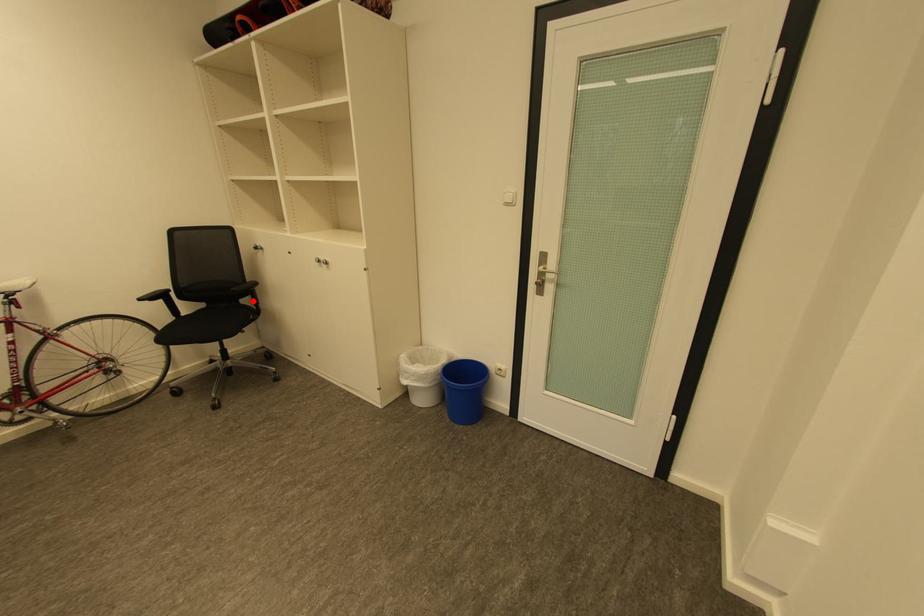
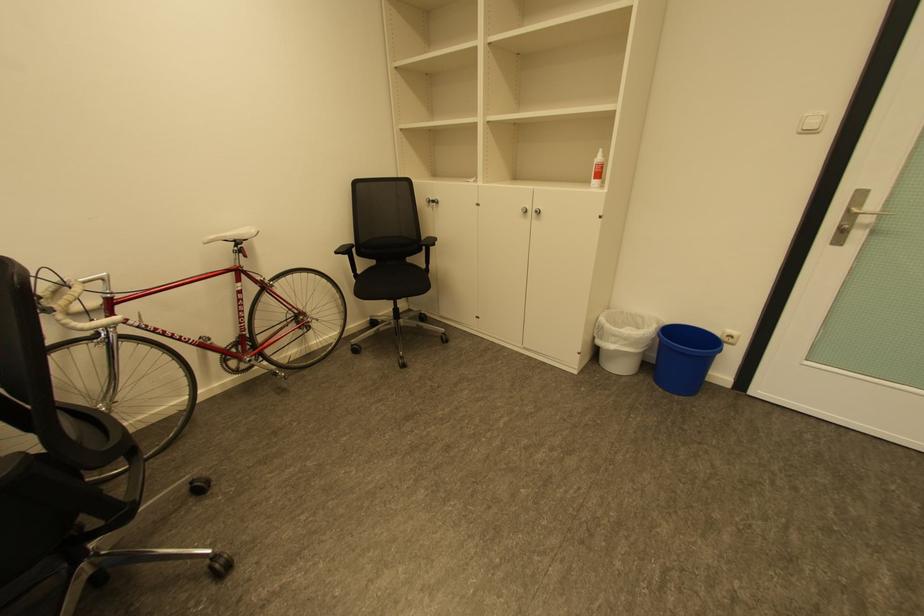
Where in the second image is the point corresponding to the highlighted location from the first image?

(426, 259)